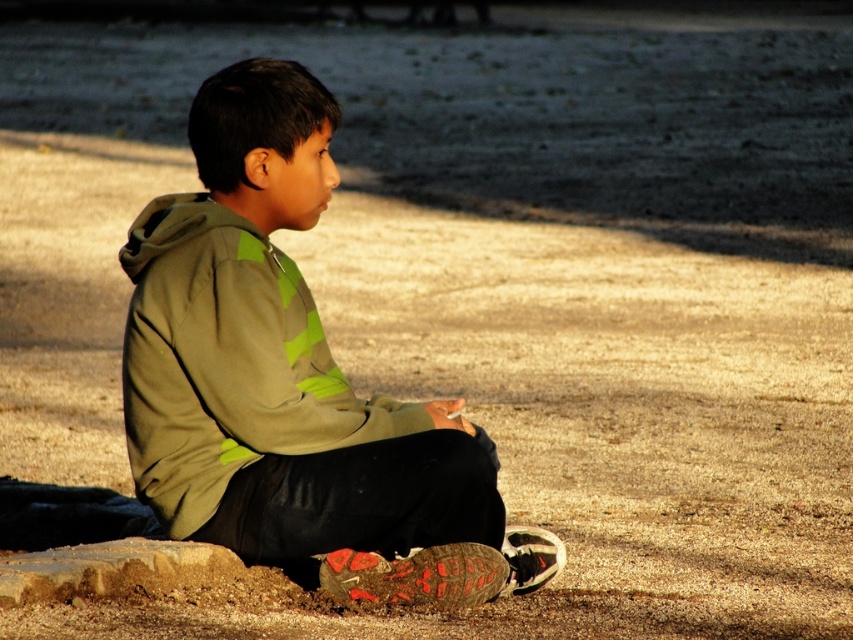
You are a photographer trying to capture the boy in the scene. Since the green matte hoodie at center and the smooth brown rock at lower left are in the frame, which object should you focus on to ensure the subject is sharp given the camera can only focus on one object at a time?

The green matte hoodie at center is larger in size than the smooth brown rock at lower left, so focusing on the green matte hoodie at center would ensure the subject is sharp as it is the larger object in the frame.

The boy is sitting on the ground and wearing the green matte hoodie at center. If he wants to place the smooth brown rock at lower left on top of his hoodie, will it fit without falling over?

The green matte hoodie at center is taller than smooth brown rock at lower left, so the rock will not tip over when placed on top of the hoodie.